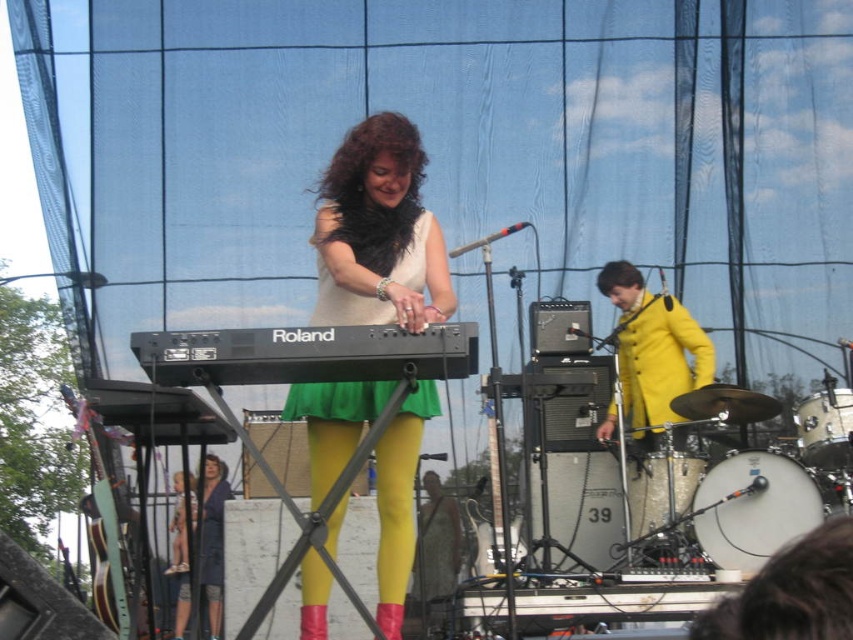
Question: Which object appears farthest from the camera in this image?

Choices:
 (A) shiny silver cymbal at center right
 (B) black matte keyboard at center

Answer: (A)

Question: Which object is positioned farthest from the black matte keyboard at center?

Choices:
 (A) green glossy guitar at left
 (B) matte blue dress at lower left

Answer: (B)

Question: Which object is the farthest from the green glossy guitar at left?

Choices:
 (A) black matte keyboard at center
 (B) yellow matte jacket at center
 (C) yellow fabric skirt at center
 (D) green fabric dress at center

Answer: (B)

Question: Observing the image, what is the correct spatial positioning of yellow fabric skirt at center in reference to yellow matte jacket at center?

Choices:
 (A) left
 (B) right

Answer: (A)

Question: Does black matte keyboard at center appear under shiny silver cymbal at center right?

Choices:
 (A) no
 (B) yes

Answer: (A)

Question: Is the position of green fabric dress at center more distant than that of matte blue dress at lower left?

Choices:
 (A) no
 (B) yes

Answer: (A)